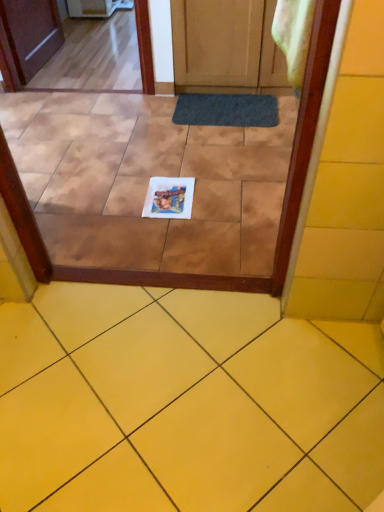
What are the coordinates of `free region under white glossy coaster at center (from a real-world perspective)` in the screenshot? It's located at (171, 198).